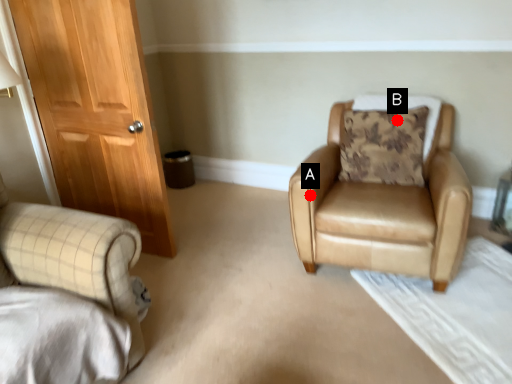
Question: Two points are circled on the image, labeled by A and B beside each circle. Which point is farther from the camera taking this photo?

Choices:
 (A) A is further
 (B) B is further

Answer: (B)